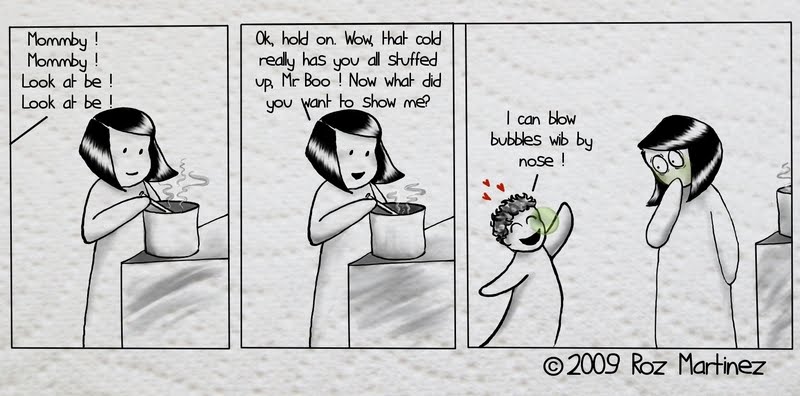
Find the location of a particular element. The height and width of the screenshot is (396, 800). white paper towel textured background is located at coordinates (745, 7).